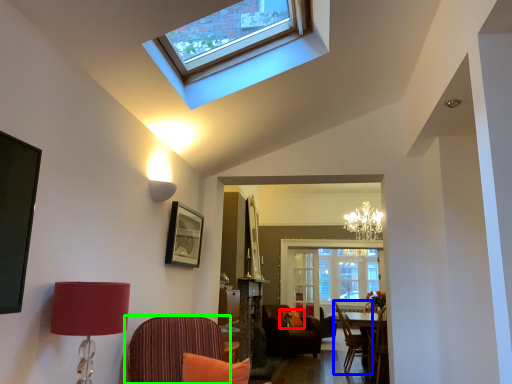
Question: Based on their relative distances, which object is farther from pillow (highlighted by a red box)? Choose from chair (highlighted by a blue box) and chair (highlighted by a green box).

Choices:
 (A) chair
 (B) chair

Answer: (B)